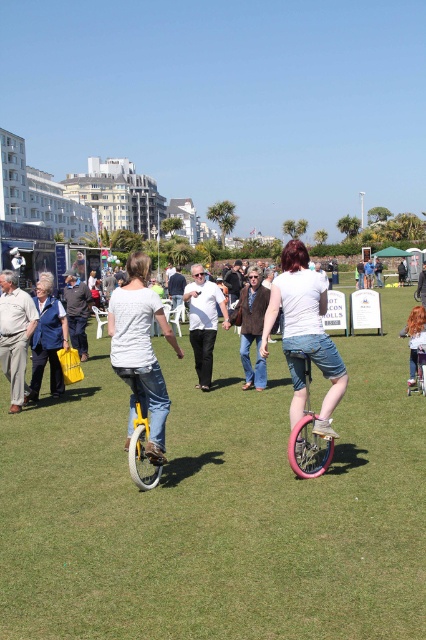
Is point (6, 364) farther from viewer compared to point (88, 310)?

No, (6, 364) is closer to viewer.

Is light brown fabric pants at left bigger than dark gray sweater at left?

Yes, light brown fabric pants at left is bigger than dark gray sweater at left.

Where is `light brown fabric pants at left`? This screenshot has width=426, height=640. light brown fabric pants at left is located at coordinates (14, 333).

Can you confirm if green grass at center is thinner than brown woolen vest at center?

In fact, green grass at center might be wider than brown woolen vest at center.

Can you confirm if green grass at center is positioned below brown woolen vest at center?

Yes, green grass at center is below brown woolen vest at center.

Who is more forward, (29, 588) or (245, 310)?

Point (29, 588) is in front.

Find the location of a particular element. Image resolution: width=426 pixels, height=640 pixels. green grass at center is located at coordinates (218, 506).

Based on the photo, is the position of green grass at center more distant than that of yellow matte unicycle at left?

No, green grass at center is closer to the viewer.

The height and width of the screenshot is (640, 426). Find the location of `green grass at center`. green grass at center is located at coordinates (218, 506).

Identify the location of green grass at center. (218, 506).